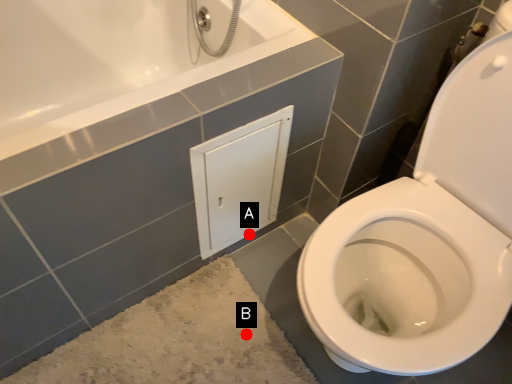
Question: Two points are circled on the image, labeled by A and B beside each circle. Which point is closer to the camera taking this photo?

Choices:
 (A) A is closer
 (B) B is closer

Answer: (B)